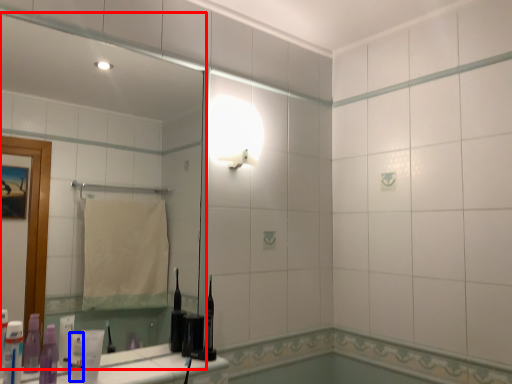
Question: Which object appears closest to the camera in this image, mirror (highlighted by a red box) or toiletry (highlighted by a blue box)?

Choices:
 (A) mirror
 (B) toiletry

Answer: (A)